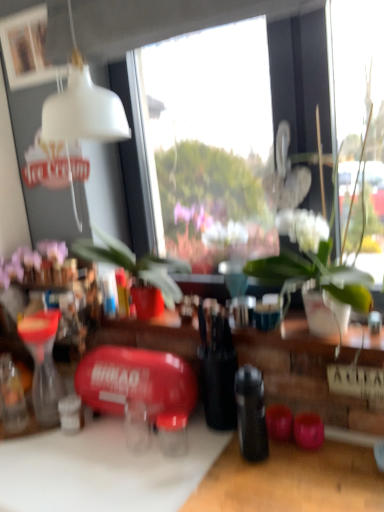
The image size is (384, 512). Identify the location of black matte bottle at center. (251, 413).

Where is `white matte cutting board at lower left`? This screenshot has width=384, height=512. white matte cutting board at lower left is located at coordinates (101, 469).

This screenshot has width=384, height=512. Identify the location of white glossy vase at center. (311, 263).

At what (x,y) coordinates should I click in order to perform the action: click on white matte picture frame at upper left. Please return your answer as a coordinate pair (x, y). The width and height of the screenshot is (384, 512). Looking at the image, I should click on (27, 49).

The height and width of the screenshot is (512, 384). I want to click on purple matte flowers at upper left, so click(x=32, y=261).

Does white matte picture frame at upper left have a greater height compared to black matte bottle at center?

In fact, white matte picture frame at upper left may be shorter than black matte bottle at center.

Is white matte picture frame at upper left outside of black matte bottle at center?

Indeed, white matte picture frame at upper left is completely outside black matte bottle at center.

Does point (256, 451) appear closer or farther from the camera than point (6, 62)?

Point (256, 451) appears to be closer to the viewer than point (6, 62).

Based on the photo, from the image's perspective, which is above, black matte bottle at center or white matte picture frame at upper left?

white matte picture frame at upper left, from the image's perspective.

Is black matte bottle at center further to the viewer compared to white matte picture frame at upper left?

No, it is in front of white matte picture frame at upper left.

You are a GUI agent. You are given a task and a screenshot of the screen. Output one action in this format:
    pyautogui.click(x=<x>, y=<y>)
    Task: Click on the bottle in front of the white matte picture frame at upper left
    The height and width of the screenshot is (512, 384).
    Given the screenshot: What is the action you would take?
    pyautogui.click(x=251, y=413)

Which is behind, white glossy vase at center or white matte picture frame at upper left?

white matte picture frame at upper left is further away from the camera.

Is white glossy vase at center completely or partially outside of white matte picture frame at upper left?

Yes, white glossy vase at center is outside of white matte picture frame at upper left.

Considering the relative sizes of white glossy vase at center and white matte picture frame at upper left in the image provided, is white glossy vase at center thinner than white matte picture frame at upper left?

In fact, white glossy vase at center might be wider than white matte picture frame at upper left.

Is white glossy vase at center bigger than white matte picture frame at upper left?

Yes, white glossy vase at center is bigger than white matte picture frame at upper left.

Considering the relative sizes of white glossy vase at center and white matte cutting board at lower left in the image provided, is white glossy vase at center taller than white matte cutting board at lower left?

No, white glossy vase at center is not taller than white matte cutting board at lower left.

Is white glossy vase at center not near white matte cutting board at lower left?

white glossy vase at center is near white matte cutting board at lower left, not far away.

Locate an element on the screen. This screenshot has height=512, width=384. houseplant lying behind the white matte cutting board at lower left is located at coordinates (311, 263).

Is point (328, 240) behind point (168, 314)?

No, (328, 240) is in front of (168, 314).

Relative to white matte cutting board at lower left, is black matte bottle at center in front or behind?

In the image, black matte bottle at center appears behind white matte cutting board at lower left.

Considering the relative sizes of black matte bottle at center and white matte cutting board at lower left in the image provided, is black matte bottle at center taller than white matte cutting board at lower left?

Incorrect, the height of black matte bottle at center is not larger of that of white matte cutting board at lower left.

Is black matte bottle at center directly adjacent to white matte cutting board at lower left?

No, black matte bottle at center is not next to white matte cutting board at lower left.

Between black matte bottle at center and white matte cutting board at lower left, which one has larger width?

white matte cutting board at lower left is wider.

Find the location of a particular element. The width and height of the screenshot is (384, 512). houseplant above the purple matte flowers at upper left (from the image's perspective) is located at coordinates (311, 263).

From the image's perspective, is purple matte flowers at upper left on white glossy vase at center?

Actually, purple matte flowers at upper left appears below white glossy vase at center in the image.

Considering the relative sizes of purple matte flowers at upper left and white glossy vase at center in the image provided, is purple matte flowers at upper left shorter than white glossy vase at center?

Yes.

From the image's perspective, is white matte cutting board at lower left above or below purple matte flowers at upper left?

Answer: Clearly, from the image's perspective, white matte cutting board at lower left is below purple matte flowers at upper left.

How many degrees apart are the facing directions of white matte cutting board at lower left and purple matte flowers at upper left?

The angle between the facing direction of white matte cutting board at lower left and the facing direction of purple matte flowers at upper left is 1.87 degrees.

Can you confirm if white matte cutting board at lower left is thinner than purple matte flowers at upper left?

In fact, white matte cutting board at lower left might be wider than purple matte flowers at upper left.

Where is `table that is on the right side of purple matte flowers at upper left`? The image size is (384, 512). table that is on the right side of purple matte flowers at upper left is located at coordinates (101, 469).

You are a GUI agent. You are given a task and a screenshot of the screen. Output one action in this format:
    pyautogui.click(x=<x>, y=<y>)
    Task: Click on the picture frame that is behind the black matte bottle at center
    The image size is (384, 512).
    Given the screenshot: What is the action you would take?
    pyautogui.click(x=27, y=49)

You are a GUI agent. You are given a task and a screenshot of the screen. Output one action in this format:
    pyautogui.click(x=<x>, y=<y>)
    Task: Click on the bottle below the white matte picture frame at upper left (from the image's perspective)
    
    Given the screenshot: What is the action you would take?
    pyautogui.click(x=251, y=413)

From the image, which object appears to be nearer to white glossy vase at center, black matte bottle at center or purple matte flowers at upper left?

Among the two, black matte bottle at center is located nearer to white glossy vase at center.

In the scene shown: Based on their spatial positions, is white glossy vase at center or white matte cutting board at lower left closer to white matte picture frame at upper left?

white glossy vase at center lies closer to white matte picture frame at upper left than the other object.

Based on their spatial positions, is white matte picture frame at upper left or purple matte flowers at upper left further from white matte cutting board at lower left?

white matte picture frame at upper left.

Based on their spatial positions, is white matte cutting board at lower left or white matte picture frame at upper left closer to purple matte flowers at upper left?

Among the two, white matte picture frame at upper left is located nearer to purple matte flowers at upper left.

Based on their spatial positions, is white matte cutting board at lower left or black matte bottle at center closer to white glossy vase at center?

black matte bottle at center is positioned closer to the anchor white glossy vase at center.

Based on their spatial positions, is purple matte flowers at upper left or white glossy vase at center closer to white matte cutting board at lower left?

Based on the image, white glossy vase at center appears to be nearer to white matte cutting board at lower left.

Based on their spatial positions, is white glossy vase at center or purple matte flowers at upper left further from white matte picture frame at upper left?

The object further to white matte picture frame at upper left is white glossy vase at center.

From the image, which object appears to be nearer to white matte cutting board at lower left, purple matte flowers at upper left or white matte picture frame at upper left?

purple matte flowers at upper left.

Image resolution: width=384 pixels, height=512 pixels. In order to click on bottle between white glossy vase at center and white matte cutting board at lower left vertically in this screenshot , I will do `click(251, 413)`.

Locate an element on the screen. This screenshot has width=384, height=512. flower between white matte picture frame at upper left and white matte cutting board at lower left in the up-down direction is located at coordinates (32, 261).

Identify the location of houseplant between white matte picture frame at upper left and black matte bottle at center from top to bottom. The width and height of the screenshot is (384, 512). (311, 263).

I want to click on bottle between white matte picture frame at upper left and white matte cutting board at lower left in the up-down direction, so 251,413.